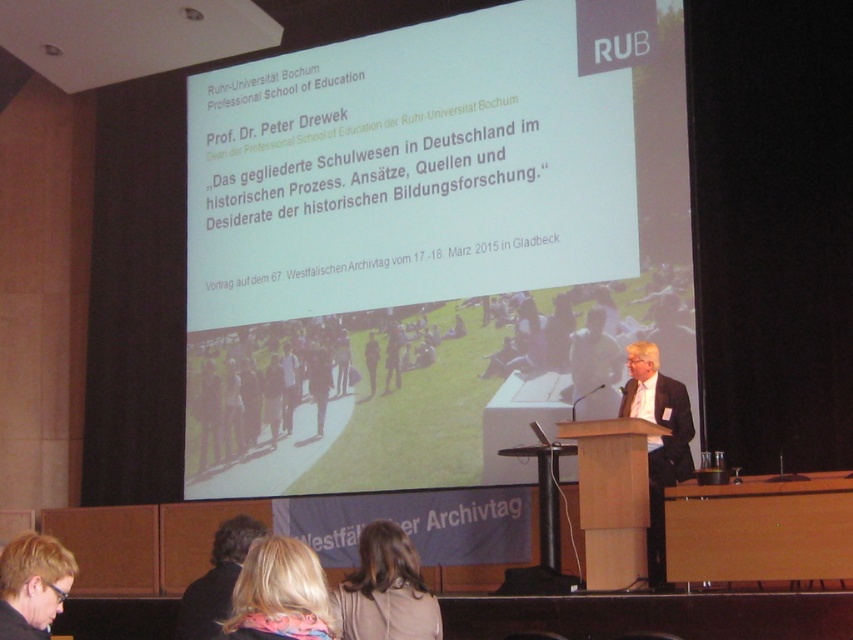
In the presentation at Ruhr University Bochum, there is a point marked at coordinates (432, 244). The speaker is standing behind a podium and there is a large projection screen with a slide titled Prof. Dr. Peter Drewek. Where exactly is the point located in relation to the white paper at upper center?

The point at (432, 244) is located on the white paper at upper center.